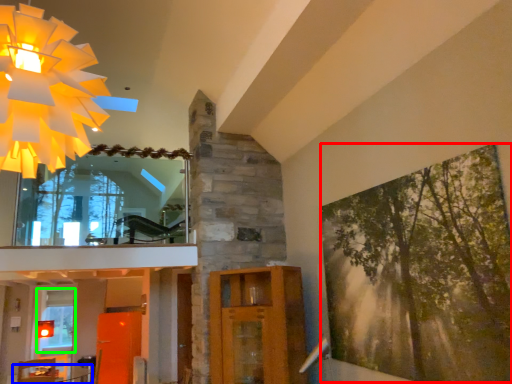
Question: Estimate the real-world distances between objects in this image. Which object is farther from tree (highlighted by a red box), table (highlighted by a blue box) or window (highlighted by a green box)?

Choices:
 (A) table
 (B) window

Answer: (A)